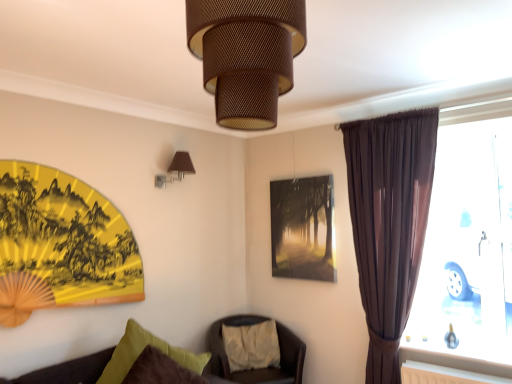
Question: In which direction should I rotate to look at brown textured lampshade at upper center, the 2th lamp positioned from the back?

Choices:
 (A) left
 (B) right

Answer: (A)

Question: Is brown sheer curtain at right at the right side of white cotton pillow at center, placed as the first pillow when sorted from back to front?

Choices:
 (A) no
 (B) yes

Answer: (B)

Question: Can you confirm if brown sheer curtain at right is taller than white cotton pillow at center, marked as the 1th pillow in a right-to-left arrangement?

Choices:
 (A) no
 (B) yes

Answer: (B)

Question: Is brown sheer curtain at right facing away from white cotton pillow at center, which is the second pillow from front to back?

Choices:
 (A) yes
 (B) no

Answer: (B)

Question: Is brown sheer curtain at right oriented towards white cotton pillow at center, which is the second pillow from front to back?

Choices:
 (A) yes
 (B) no

Answer: (B)

Question: Can you confirm if brown sheer curtain at right is smaller than white cotton pillow at center, marked as the 1th pillow in a right-to-left arrangement?

Choices:
 (A) no
 (B) yes

Answer: (A)

Question: Is brown sheer curtain at right shorter than white cotton pillow at center, which is the second pillow from front to back?

Choices:
 (A) no
 (B) yes

Answer: (A)

Question: Is velvet green pillow at lower left, the 1th pillow from the front, positioned with its back to brown sheer curtain at right?

Choices:
 (A) yes
 (B) no

Answer: (B)

Question: Is velvet green pillow at lower left, the 1th pillow from the front, to the left of brown sheer curtain at right from the viewer's perspective?

Choices:
 (A) yes
 (B) no

Answer: (A)

Question: Is brown sheer curtain at right completely or partially inside velvet green pillow at lower left, positioned as the 2th pillow in back-to-front order?

Choices:
 (A) yes
 (B) no

Answer: (B)

Question: Is velvet green pillow at lower left, acting as the first pillow starting from the left, closer to the viewer compared to brown sheer curtain at right?

Choices:
 (A) no
 (B) yes

Answer: (B)

Question: From a real-world perspective, does velvet green pillow at lower left, acting as the first pillow starting from the left, stand above brown sheer curtain at right?

Choices:
 (A) yes
 (B) no

Answer: (B)

Question: Is velvet green pillow at lower left, the 1th pillow from the front, at the right side of brown sheer curtain at right?

Choices:
 (A) no
 (B) yes

Answer: (A)

Question: Does white cotton pillow at center, which is the second pillow from front to back, have a lesser height compared to velvet green pillow at lower left, positioned as the 2th pillow in back-to-front order?

Choices:
 (A) no
 (B) yes

Answer: (B)